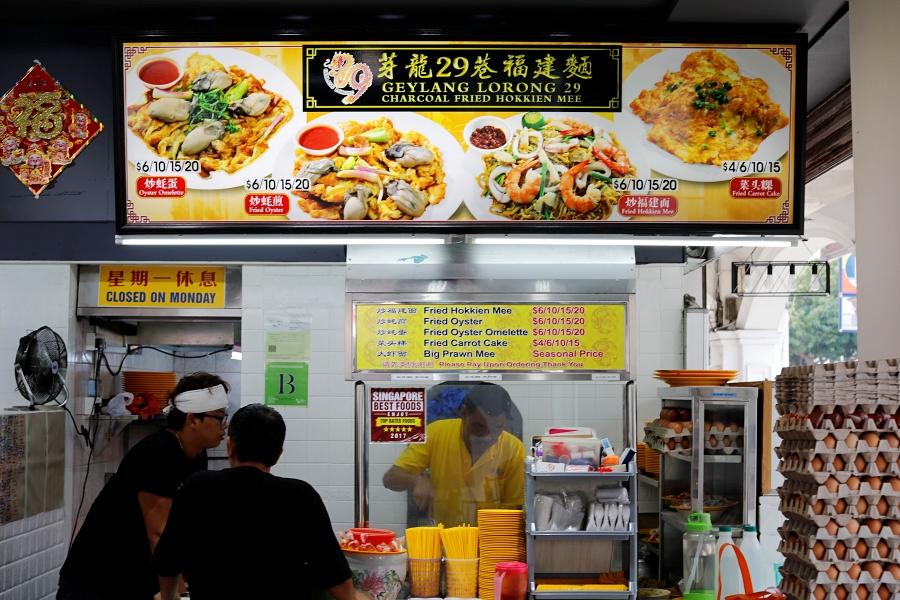
Find the location of a particular element. The width and height of the screenshot is (900, 600). large stack of plates is located at coordinates click(500, 544).